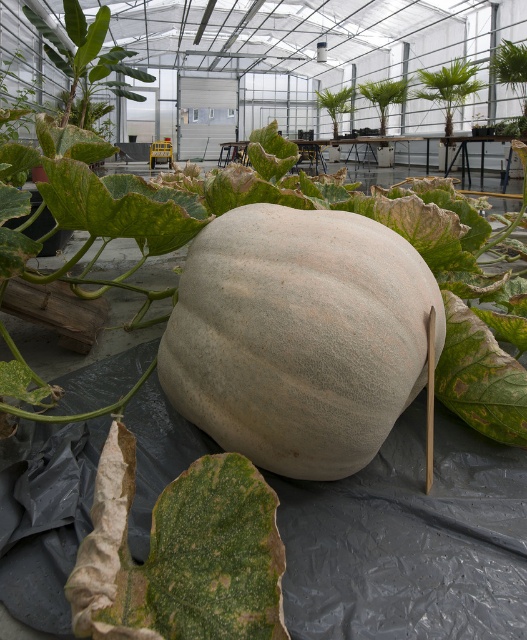
Question: Estimate the real-world distances between objects in this image. Which object is closer to the green matte plant at center?

Choices:
 (A) green leafy plant at upper center
 (B) smooth beige pumpkin at center

Answer: (A)

Question: Does speckled beige cantaloupe at center have a smaller size compared to green leafy plant at upper right?

Choices:
 (A) yes
 (B) no

Answer: (A)

Question: Which object is the closest to the green leafy plant at upper right?

Choices:
 (A) green leafy plant at upper center
 (B) smooth beige pumpkin at center
 (C) green matte plant at center

Answer: (A)

Question: Is smooth beige pumpkin at center bigger than green matte plant at center?

Choices:
 (A) yes
 (B) no

Answer: (B)

Question: Does smooth beige pumpkin at center appear under green matte plant at center?

Choices:
 (A) yes
 (B) no

Answer: (A)

Question: Which point is farther to the camera?

Choices:
 (A) smooth beige pumpkin at center
 (B) green leafy plant at upper right
 (C) green leafy plant at center
 (D) green matte plant at center

Answer: (D)